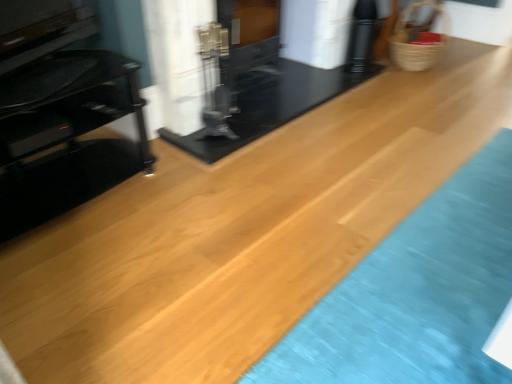
Question: Does black glass tv stand at left have a lesser height compared to woven straw basket at upper right?

Choices:
 (A) yes
 (B) no

Answer: (B)

Question: Does black glass tv stand at left come in front of woven straw basket at upper right?

Choices:
 (A) yes
 (B) no

Answer: (A)

Question: Is black glass tv stand at left positioned behind woven straw basket at upper right?

Choices:
 (A) no
 (B) yes

Answer: (A)

Question: From the image's perspective, is black glass tv stand at left below woven straw basket at upper right?

Choices:
 (A) yes
 (B) no

Answer: (A)

Question: Considering the relative sizes of black glass tv stand at left and woven straw basket at upper right in the image provided, is black glass tv stand at left thinner than woven straw basket at upper right?

Choices:
 (A) no
 (B) yes

Answer: (A)

Question: Considering their positions, is black glossy fireplace at center, marked as the second fireplace in a left-to-right arrangement, located in front of or behind black glossy fireplace at center, marked as the 2th fireplace in a right-to-left arrangement?

Choices:
 (A) behind
 (B) front

Answer: (B)

Question: Would you say black glossy fireplace at center, which is counted as the 1th fireplace, starting from the right, is inside or outside black glossy fireplace at center, marked as the 2th fireplace in a right-to-left arrangement?

Choices:
 (A) outside
 (B) inside

Answer: (A)

Question: Is black glossy fireplace at center, marked as the second fireplace in a left-to-right arrangement, wider or thinner than black glossy fireplace at center, the first fireplace viewed from the left?

Choices:
 (A) wide
 (B) thin

Answer: (A)

Question: From a real-world perspective, is black glossy fireplace at center, marked as the second fireplace in a left-to-right arrangement, physically located above or below black glossy fireplace at center, the first fireplace viewed from the left?

Choices:
 (A) above
 (B) below

Answer: (A)

Question: In the image, is black glass tv stand at left positioned in front of or behind woven straw basket at upper right?

Choices:
 (A) front
 (B) behind

Answer: (A)

Question: Choose the correct answer: Is black glass tv stand at left inside woven straw basket at upper right or outside it?

Choices:
 (A) outside
 (B) inside

Answer: (A)

Question: From a real-world perspective, is black glass tv stand at left above or below woven straw basket at upper right?

Choices:
 (A) below
 (B) above

Answer: (B)

Question: From the image's perspective, is black glass tv stand at left positioned above or below woven straw basket at upper right?

Choices:
 (A) above
 (B) below

Answer: (B)

Question: From the image's perspective, is black glossy fireplace at center, marked as the 2th fireplace in a right-to-left arrangement, positioned above or below black glass tv stand at left?

Choices:
 (A) below
 (B) above

Answer: (B)

Question: From a real-world perspective, relative to black glass tv stand at left, is black glossy fireplace at center, the first fireplace viewed from the left, vertically above or below?

Choices:
 (A) below
 (B) above

Answer: (B)